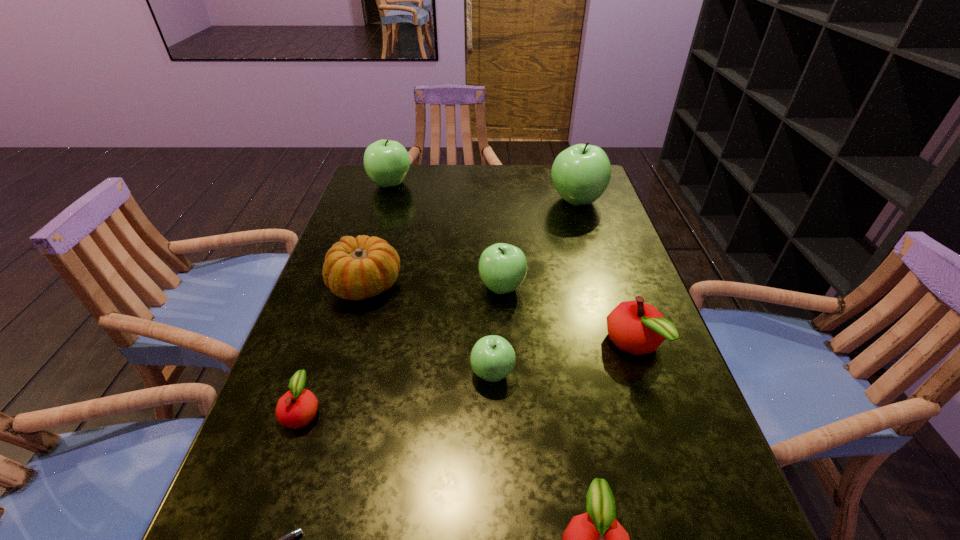
You are a GUI agent. You are given a task and a screenshot of the screen. Output one action in this format:
    pyautogui.click(x=<x>, y=<y>)
    Task: Click on the object located at the far left corner
    The width and height of the screenshot is (960, 540).
    Given the screenshot: What is the action you would take?
    pyautogui.click(x=386, y=162)

In order to click on object that is at the far right corner in this screenshot , I will do `click(581, 173)`.

This screenshot has width=960, height=540. Find the location of `vacant space at the far edge of the desktop`. vacant space at the far edge of the desktop is located at coordinates (542, 178).

The image size is (960, 540). I want to click on vacant space at the left edge, so click(x=272, y=450).

You are a GUI agent. You are given a task and a screenshot of the screen. Output one action in this format:
    pyautogui.click(x=<x>, y=<y>)
    Task: Click on the vacant area at the right edge of the desktop
    The image size is (960, 540).
    Given the screenshot: What is the action you would take?
    pyautogui.click(x=599, y=311)

In order to click on free spot between the sixth shortest apple and the nearest green apple in this screenshot , I will do `click(442, 279)`.

Where is `free space between the third biggest green apple and the biggest green apple`? This screenshot has width=960, height=540. free space between the third biggest green apple and the biggest green apple is located at coordinates (540, 244).

Identify the location of empty space between the second shortest object and the biggest green apple. (440, 306).

The width and height of the screenshot is (960, 540). I want to click on unoccupied position between the biggest green apple and the sixth shortest apple, so click(483, 192).

You are a GUI agent. You are given a task and a screenshot of the screen. Output one action in this format:
    pyautogui.click(x=<x>, y=<y>)
    Task: Click on the blank region between the tallest apple and the eighth tallest object
    The image size is (960, 540).
    Given the screenshot: What is the action you would take?
    (440, 306)